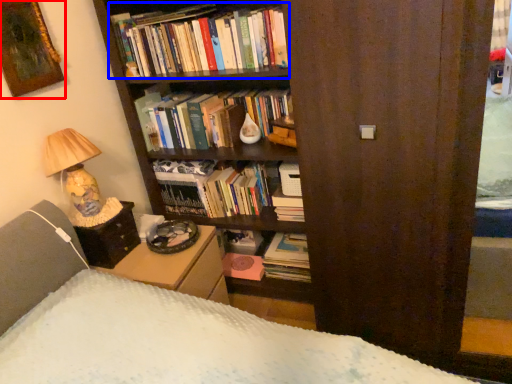
Question: Which object appears farthest to the camera in this image, picture frame (highlighted by a red box) or book (highlighted by a blue box)?

Choices:
 (A) picture frame
 (B) book

Answer: (B)